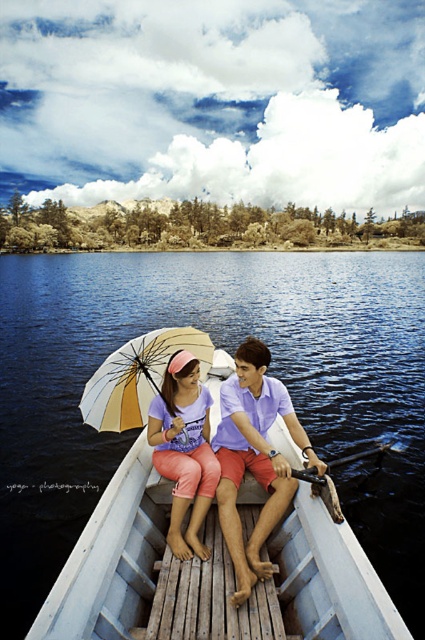
You are standing at the point marked by coordinates point [229,353]. What is the color of the surface you are currently standing on?

The point [229,353] marks blue water at center, so the surface you are standing on is blue water.

Consider the image. You are standing on the dock and want to throw a small ball to the person wearing the matte pink shorts at center. The ball can travel a maximum distance of 10 meters. Will the ball reach the person if you throw it towards the blue water at center?

The blue water at center is 9.54 meters from matte pink shorts at center. Since the ball can travel up to 10 meters, it will reach the person wearing the matte pink shorts at center.

You are standing at the center of the boat and want to reach the point indicated by the coordinates given in the objects. Which direction should you move to reach the point indicated by point (254, 458)?

The point (254, 458) indicates the matte purple shirt at center, so you are already at the correct location since you are standing at the center of the boat.